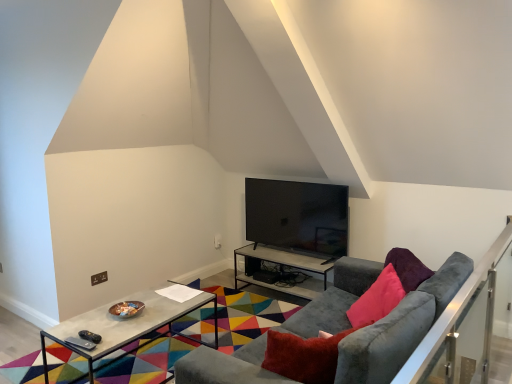
Question: Considering the positions of black glossy tv at center and metallic gray table at center, placed as the 2th table when sorted from left to right, in the image, is black glossy tv at center bigger or smaller than metallic gray table at center, placed as the 2th table when sorted from left to right,?

Choices:
 (A) small
 (B) big

Answer: (A)

Question: From a real-world perspective, is black glossy tv at center above or below metallic gray table at center, arranged as the second table when viewed from the front?

Choices:
 (A) below
 (B) above

Answer: (B)

Question: Which is nearer to the black glossy tv at center?

Choices:
 (A) velvet grey couch at center
 (B) concrete table at center, arranged as the 2th table when viewed from the back
 (C) metallic gray table at center, the 1th table viewed from the back
 (D) satin silver balustrade at right

Answer: (C)

Question: Which object is positioned closest to the satin silver balustrade at right?

Choices:
 (A) metallic gray table at center, the 1th table viewed from the back
 (B) concrete table at center, acting as the first table starting from the front
 (C) black glossy tv at center
 (D) velvet grey couch at center

Answer: (D)